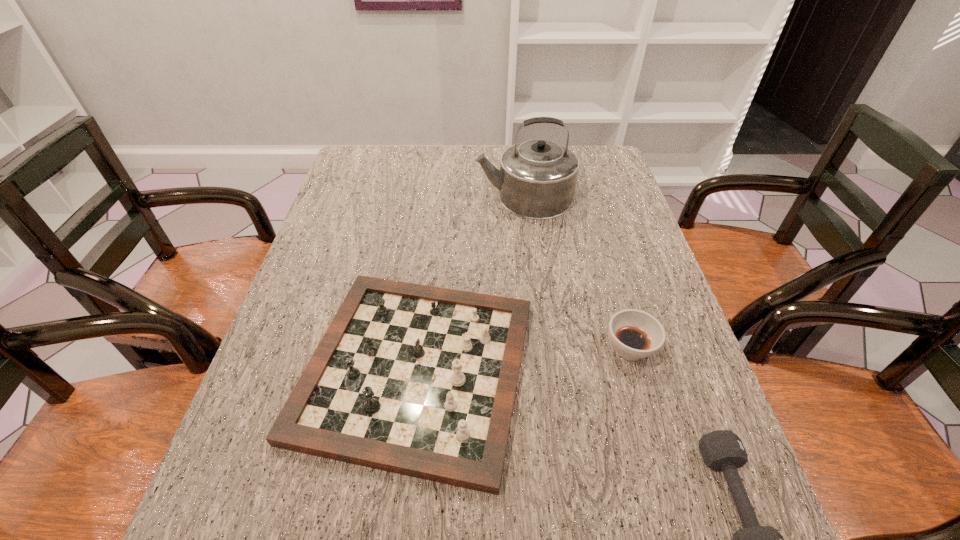
At what (x,y) coordinates should I click in order to perform the action: click on object positioned at the left edge. Please return your answer as a coordinate pair (x, y). The height and width of the screenshot is (540, 960). Looking at the image, I should click on (417, 380).

Image resolution: width=960 pixels, height=540 pixels. I want to click on kettle that is at the right edge, so click(537, 178).

Identify the location of soup bowl that is at the right edge. (635, 334).

What are the coordinates of `object located in the far right corner section of the desktop` in the screenshot? It's located at (537, 178).

You are a GUI agent. You are given a task and a screenshot of the screen. Output one action in this format:
    pyautogui.click(x=<x>, y=<y>)
    Task: Click on the vacant position at the far edge of the desktop
    This screenshot has width=960, height=540.
    Given the screenshot: What is the action you would take?
    pyautogui.click(x=477, y=155)

The image size is (960, 540). In the image, there is a desktop. Find the location of `blank space at the near edge`. blank space at the near edge is located at coordinates (477, 532).

Where is `vacant space at the left edge of the desktop`? The width and height of the screenshot is (960, 540). vacant space at the left edge of the desktop is located at coordinates (248, 509).

Where is `vacant region at the right edge of the desktop`? Image resolution: width=960 pixels, height=540 pixels. vacant region at the right edge of the desktop is located at coordinates (604, 272).

At what (x,y) coordinates should I click in order to perform the action: click on blank space at the far left corner. Please return your answer as a coordinate pair (x, y). Looking at the image, I should click on (349, 176).

Locate an element on the screen. empty space between the soup bowl and the farthest object is located at coordinates (577, 273).